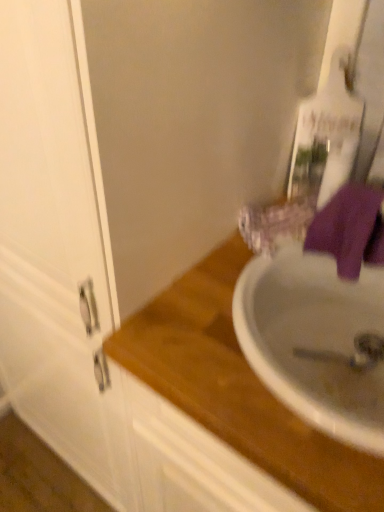
The width and height of the screenshot is (384, 512). Find the location of `wooden at upper right`. wooden at upper right is located at coordinates (237, 388).

What do you see at coordinates (237, 388) in the screenshot? I see `wooden at upper right` at bounding box center [237, 388].

What do you see at coordinates (350, 229) in the screenshot?
I see `purple fabric towel at right` at bounding box center [350, 229].

Locate an element on the screen. purple fabric towel at right is located at coordinates [350, 229].

This screenshot has height=512, width=384. Find the location of `wooden at upper right`. wooden at upper right is located at coordinates (237, 388).

Considering the relative positions of wooden at upper right and purple fabric towel at right in the image provided, is wooden at upper right to the right of purple fabric towel at right from the viewer's perspective?

No, wooden at upper right is not to the right of purple fabric towel at right.

Is wooden at upper right positioned in front of purple fabric towel at right?

Yes, wooden at upper right is closer to the viewer.

Does point (185, 347) appear closer or farther from the camera than point (335, 195)?

Point (185, 347) appears to be closer to the viewer than point (335, 195).

From the image's perspective, which one is positioned lower, wooden at upper right or purple fabric towel at right?

wooden at upper right.

From the picture: From a real-world perspective, who is located higher, wooden at upper right or purple fabric towel at right?

purple fabric towel at right.

Looking at their sizes, would you say wooden at upper right is wider or thinner than purple fabric towel at right?

Considering their sizes, wooden at upper right looks broader than purple fabric towel at right.

Considering the sizes of wooden at upper right and purple fabric towel at right in the image, is wooden at upper right taller or shorter than purple fabric towel at right?

Clearly, wooden at upper right is taller compared to purple fabric towel at right.

Which of these two, wooden at upper right or purple fabric towel at right, is smaller?

purple fabric towel at right is smaller.

Would you say wooden at upper right is inside or outside purple fabric towel at right?

wooden at upper right exists outside the volume of purple fabric towel at right.

Is wooden at upper right next to purple fabric towel at right?

wooden at upper right and purple fabric towel at right are clearly separated.

Is wooden at upper right aimed at purple fabric towel at right?

No, wooden at upper right is not turned towards purple fabric towel at right.

How different are the orientations of wooden at upper right and purple fabric towel at right in degrees?

There is a 47.6-degree angle between the facing directions of wooden at upper right and purple fabric towel at right.

Image resolution: width=384 pixels, height=512 pixels. What are the coordinates of `countertop in front of the purple fabric towel at right` in the screenshot? It's located at (237, 388).

Is purple fabric towel at right at the left side of wooden at upper right?

Incorrect, purple fabric towel at right is not on the left side of wooden at upper right.

Is purple fabric towel at right closer to camera compared to wooden at upper right?

No, purple fabric towel at right is further to the viewer.

Does point (343, 224) appear closer or farther from the camera than point (135, 371)?

Point (343, 224) is farther from the camera than point (135, 371).

From the image's perspective, is purple fabric towel at right below wooden at upper right?

No, from the image's perspective, purple fabric towel at right is not beneath wooden at upper right.

From a real-world perspective, which object stands above the other?

purple fabric towel at right is physically above.

Is purple fabric towel at right wider than wooden at upper right?

No, purple fabric towel at right is not wider than wooden at upper right.

Consider the image. Does purple fabric towel at right have a lesser height compared to wooden at upper right?

Correct, purple fabric towel at right is not as tall as wooden at upper right.

Which of these two, purple fabric towel at right or wooden at upper right, is bigger?

wooden at upper right is bigger.

In the scene shown: Is wooden at upper right completely or partially inside purple fabric towel at right?

That's incorrect, wooden at upper right is not inside purple fabric towel at right.

Is purple fabric towel at right next to wooden at upper right and touching it?

purple fabric towel at right is not next to wooden at upper right, and they're not touching.

Is purple fabric towel at right aimed at wooden at upper right?

No, purple fabric towel at right does not turn towards wooden at upper right.

Measure the distance from purple fabric towel at right to wooden at upper right.

A distance of 10.96 inches exists between purple fabric towel at right and wooden at upper right.

Locate an element on the screen. countertop that is below the purple fabric towel at right (from the image's perspective) is located at coordinates (237, 388).

At what (x,y) coordinates should I click in order to perform the action: click on bath towel above the wooden at upper right (from the image's perspective). Please return your answer as a coordinate pair (x, y). Looking at the image, I should click on (350, 229).

There is a wooden at upper right. At what (x,y) coordinates should I click in order to perform the action: click on bath towel above it (from a real-world perspective). Please return your answer as a coordinate pair (x, y). This screenshot has height=512, width=384. Looking at the image, I should click on (350, 229).